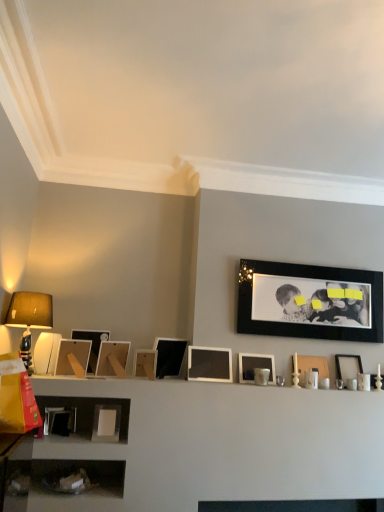
Identify the location of matte white picture frame at upper right, marked as the ninth picture frame in a left-to-right arrangement. (312, 367).

This screenshot has width=384, height=512. In order to click on wooden at center, arranged as the seventh picture frame when viewed from the right in this screenshot , I will do `click(145, 362)`.

How much space does white matte picture frame at lower left, positioned as the ninth picture frame in right-to-left order, occupy horizontally?

It is 2.64 inches.

Locate an element on the screen. white matte picture frame at lower left, positioned as the ninth picture frame in right-to-left order is located at coordinates (106, 423).

This screenshot has height=512, width=384. Find the location of `matte wooden picture frame at lower left, the first picture frame from the left`. matte wooden picture frame at lower left, the first picture frame from the left is located at coordinates (73, 357).

Locate an element on the screen. matte black picture frame at center, which is counted as the sixth picture frame, starting from the left is located at coordinates (169, 356).

Which object is positioned more to the left, matte black lampshade at left or matte black picture frame at center, which is counted as the 6th picture frame, starting from the right?

matte black lampshade at left.

Can you tell me how much matte black lampshade at left and matte black picture frame at center, which is counted as the 6th picture frame, starting from the right, differ in facing direction?

141 degrees.

Considering the sizes of objects matte black lampshade at left and matte black picture frame at center, which is counted as the sixth picture frame, starting from the left, in the image provided, who is wider, matte black lampshade at left or matte black picture frame at center, which is counted as the sixth picture frame, starting from the left,?

With larger width is matte black lampshade at left.

The image size is (384, 512). I want to click on table lamp above the matte black picture frame at center, which is counted as the sixth picture frame, starting from the left (from a real-world perspective), so click(x=29, y=317).

Who is bigger, white matte picture frame at center, acting as the fourth picture frame starting from the right, or black matte picture frame at upper right, which ranks as the second picture frame in right-to-left order?

black matte picture frame at upper right, which ranks as the second picture frame in right-to-left order, is bigger.

Would you say white matte picture frame at center, acting as the fourth picture frame starting from the right, contains black matte picture frame at upper right, which is counted as the tenth picture frame, starting from the left?

That's incorrect, black matte picture frame at upper right, which is counted as the tenth picture frame, starting from the left, is not inside white matte picture frame at center, acting as the fourth picture frame starting from the right.

Can you see white matte picture frame at center, which appears as the 8th picture frame when viewed from the left, touching black matte picture frame at upper right, which is counted as the tenth picture frame, starting from the left?

white matte picture frame at center, which appears as the 8th picture frame when viewed from the left, and black matte picture frame at upper right, which is counted as the tenth picture frame, starting from the left, are not in contact.

Is white glossy picture frame at right, the eleventh picture frame viewed from the left, in front of white matte picture frame at center, acting as the fourth picture frame starting from the right?

No.

Is white glossy picture frame at right, the 1th picture frame when ordered from right to left, not close to white matte picture frame at center, which appears as the 8th picture frame when viewed from the left?

white glossy picture frame at right, the 1th picture frame when ordered from right to left, is near white matte picture frame at center, which appears as the 8th picture frame when viewed from the left, not far away.

Looking at this image, does white glossy picture frame at right, the 1th picture frame when ordered from right to left, appear on the left side of white matte picture frame at center, which appears as the 8th picture frame when viewed from the left?

No.

Is matte wooden picture frame at left, which is counted as the second picture frame, starting from the left, shorter than white matte picture frame at center, the seventh picture frame from the left?

No.

Considering the sizes of matte wooden picture frame at left, which is counted as the second picture frame, starting from the left, and white matte picture frame at center, the seventh picture frame from the left, in the image, is matte wooden picture frame at left, which is counted as the second picture frame, starting from the left, bigger or smaller than white matte picture frame at center, the seventh picture frame from the left,?

In the image, matte wooden picture frame at left, which is counted as the second picture frame, starting from the left, appears to be larger than white matte picture frame at center, the seventh picture frame from the left.

Is point (93, 369) more distant than point (200, 348)?

No, (93, 369) is closer to viewer.

How many degrees apart are the facing directions of matte wooden picture frame at left, which is counted as the second picture frame, starting from the left, and white matte picture frame at center, the seventh picture frame from the left?

The angle between the facing direction of matte wooden picture frame at left, which is counted as the second picture frame, starting from the left, and the facing direction of white matte picture frame at center, the seventh picture frame from the left, is 2.77 degrees.

Between black matte picture frame at upper right, which ranks as the second picture frame in right-to-left order, and matte black lampshade at left, which one has more height?

black matte picture frame at upper right, which ranks as the second picture frame in right-to-left order.

In the scene shown: Considering the relative positions of black matte picture frame at upper right, which is counted as the tenth picture frame, starting from the left, and matte black lampshade at left in the image provided, is black matte picture frame at upper right, which is counted as the tenth picture frame, starting from the left, to the left of matte black lampshade at left from the viewer's perspective?

No, black matte picture frame at upper right, which is counted as the tenth picture frame, starting from the left, is not to the left of matte black lampshade at left.

Is black matte picture frame at upper right, which ranks as the second picture frame in right-to-left order, facing away from matte black lampshade at left?

No.

Looking at this image, considering the relative sizes of black matte picture frame at upper right, which is counted as the tenth picture frame, starting from the left, and matte black lampshade at left in the image provided, is black matte picture frame at upper right, which is counted as the tenth picture frame, starting from the left, wider than matte black lampshade at left?

No, black matte picture frame at upper right, which is counted as the tenth picture frame, starting from the left, is not wider than matte black lampshade at left.

From a real-world perspective, relative to matte white picture frame at upper right, marked as the ninth picture frame in a left-to-right arrangement, is black matte picture frame at upper right, which is counted as the tenth picture frame, starting from the left, vertically above or below?

Clearly, from a real-world perspective, black matte picture frame at upper right, which is counted as the tenth picture frame, starting from the left, is above matte white picture frame at upper right, marked as the ninth picture frame in a left-to-right arrangement.

Which is farther, [290,317] or [313,359]?

The point [290,317] is behind.

Considering the sizes of black matte picture frame at upper right, which ranks as the second picture frame in right-to-left order, and matte white picture frame at upper right, positioned as the third picture frame in right-to-left order, in the image, is black matte picture frame at upper right, which ranks as the second picture frame in right-to-left order, wider or thinner than matte white picture frame at upper right, positioned as the third picture frame in right-to-left order,?

black matte picture frame at upper right, which ranks as the second picture frame in right-to-left order, is thinner than matte white picture frame at upper right, positioned as the third picture frame in right-to-left order.

Which is correct: black matte picture frame at upper right, which ranks as the second picture frame in right-to-left order, is inside matte white picture frame at upper right, marked as the ninth picture frame in a left-to-right arrangement, or outside of it?

black matte picture frame at upper right, which ranks as the second picture frame in right-to-left order, is spatially situated outside matte white picture frame at upper right, marked as the ninth picture frame in a left-to-right arrangement.

Which object is closer to the camera taking this photo, matte black lampshade at left or white glossy picture frame at right, the 1th picture frame when ordered from right to left?

matte black lampshade at left is closer to the camera.

Could you tell me if matte black lampshade at left is turned towards white glossy picture frame at right, the 1th picture frame when ordered from right to left?

No, matte black lampshade at left is not facing towards white glossy picture frame at right, the 1th picture frame when ordered from right to left.

Considering the positions of point (19, 314) and point (355, 362), is point (19, 314) closer or farther from the camera than point (355, 362)?

Point (19, 314) appears to be closer to the viewer than point (355, 362).

Is matte black lampshade at left to the left or to the right of white glossy picture frame at right, the eleventh picture frame viewed from the left, in the image?

matte black lampshade at left is to the left of white glossy picture frame at right, the eleventh picture frame viewed from the left.

Locate an element on the screen. The width and height of the screenshot is (384, 512). the 6th picture frame to the right when counting from the matte black lampshade at left is located at coordinates (169, 356).

Find the location of a particular element. The image size is (384, 512). the 1st picture frame in front of the black matte picture frame at upper right, which ranks as the second picture frame in right-to-left order is located at coordinates (255, 367).

Based on their spatial positions, is white glossy picture frame at right, the 1th picture frame when ordered from right to left, or white matte picture frame at lower left, positioned as the ninth picture frame in right-to-left order, closer to matte wooden picture frame at lower left, the first picture frame from the left?

Among the two, white matte picture frame at lower left, positioned as the ninth picture frame in right-to-left order, is located nearer to matte wooden picture frame at lower left, the first picture frame from the left.

When comparing their distances from white matte picture frame at center, the seventh picture frame from the left, does matte black picture frame at center, which is counted as the sixth picture frame, starting from the left, or white matte picture frame at lower left, positioned as the ninth picture frame in right-to-left order, seem further?

white matte picture frame at lower left, positioned as the ninth picture frame in right-to-left order, lies further to white matte picture frame at center, the seventh picture frame from the left, than the other object.

Looking at the image, which one is located closer to matte wooden picture frame at left, which is counted as the second picture frame, starting from the left, white glossy picture frame at right, the 1th picture frame when ordered from right to left, or matte wooden picture frame at center, the 4th picture frame from the left?

matte wooden picture frame at center, the 4th picture frame from the left, is closer to matte wooden picture frame at left, which is counted as the second picture frame, starting from the left.

Looking at the image, which one is located further to matte wooden picture frame at center, positioned as the 8th picture frame in right-to-left order, white glossy picture frame at right, the eleventh picture frame viewed from the left, or wooden at center, which is the 5th picture frame from left to right?

white glossy picture frame at right, the eleventh picture frame viewed from the left.

Considering their positions, is white matte picture frame at center, the seventh picture frame from the left, positioned further to matte wooden picture frame at lower left, acting as the 11th picture frame starting from the right, than matte wooden picture frame at center, positioned as the 8th picture frame in right-to-left order?

white matte picture frame at center, the seventh picture frame from the left, is further to matte wooden picture frame at lower left, acting as the 11th picture frame starting from the right.

Which object lies nearer to the anchor point matte black lampshade at left, matte wooden picture frame at left, the tenth picture frame from the right, or white glossy picture frame at right, the 1th picture frame when ordered from right to left?

The object closer to matte black lampshade at left is matte wooden picture frame at left, the tenth picture frame from the right.

Which object lies nearer to the anchor point matte wooden picture frame at center, the 4th picture frame from the left, matte white picture frame at upper right, positioned as the third picture frame in right-to-left order, or matte black lampshade at left?

matte black lampshade at left is positioned closer to the anchor matte wooden picture frame at center, the 4th picture frame from the left.

Based on the photo, estimate the real-world distances between objects in this image. Which object is closer to white matte picture frame at lower left, the third picture frame viewed from the left, white matte picture frame at center, which appears as the 8th picture frame when viewed from the left, or matte black picture frame at center, which is counted as the sixth picture frame, starting from the left?

The object closer to white matte picture frame at lower left, the third picture frame viewed from the left, is matte black picture frame at center, which is counted as the sixth picture frame, starting from the left.

You are a GUI agent. You are given a task and a screenshot of the screen. Output one action in this format:
    pyautogui.click(x=<x>, y=<y>)
    Task: Click on the picture frame situated between matte black picture frame at center, which is counted as the sixth picture frame, starting from the left, and white matte picture frame at center, acting as the fourth picture frame starting from the right, from left to right
    The height and width of the screenshot is (512, 384).
    Given the screenshot: What is the action you would take?
    pyautogui.click(x=209, y=364)

The image size is (384, 512). I want to click on picture frame between wooden at center, arranged as the seventh picture frame when viewed from the right, and white matte picture frame at center, the 5th picture frame viewed from the right, so [169, 356].

Where is `picture frame between matte wooden picture frame at center, the 4th picture frame from the left, and matte black picture frame at center, which is counted as the sixth picture frame, starting from the left`? Image resolution: width=384 pixels, height=512 pixels. picture frame between matte wooden picture frame at center, the 4th picture frame from the left, and matte black picture frame at center, which is counted as the sixth picture frame, starting from the left is located at coordinates (145, 362).

Identify the location of picture frame between white matte picture frame at center, the 5th picture frame viewed from the right, and matte white picture frame at upper right, positioned as the third picture frame in right-to-left order. pyautogui.click(x=255, y=367).